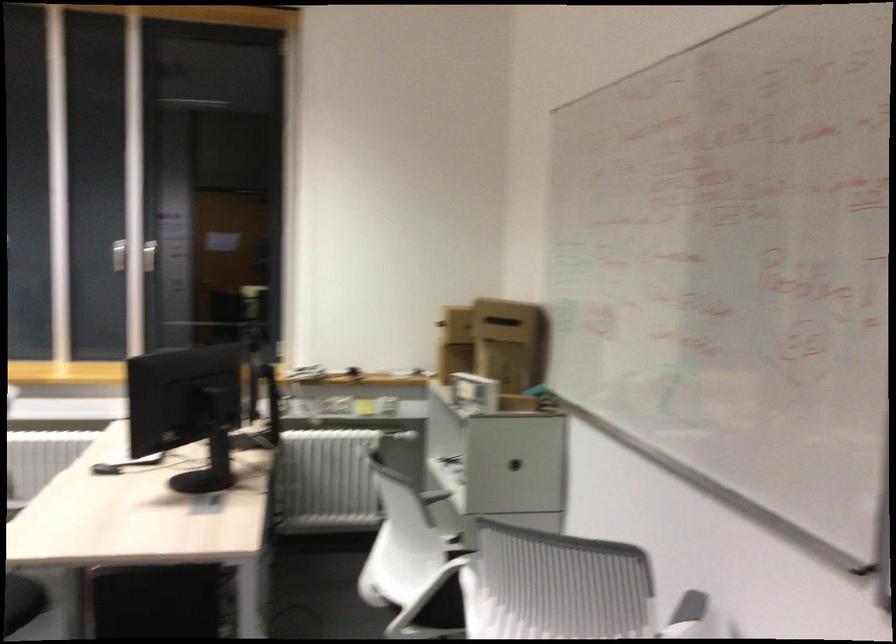
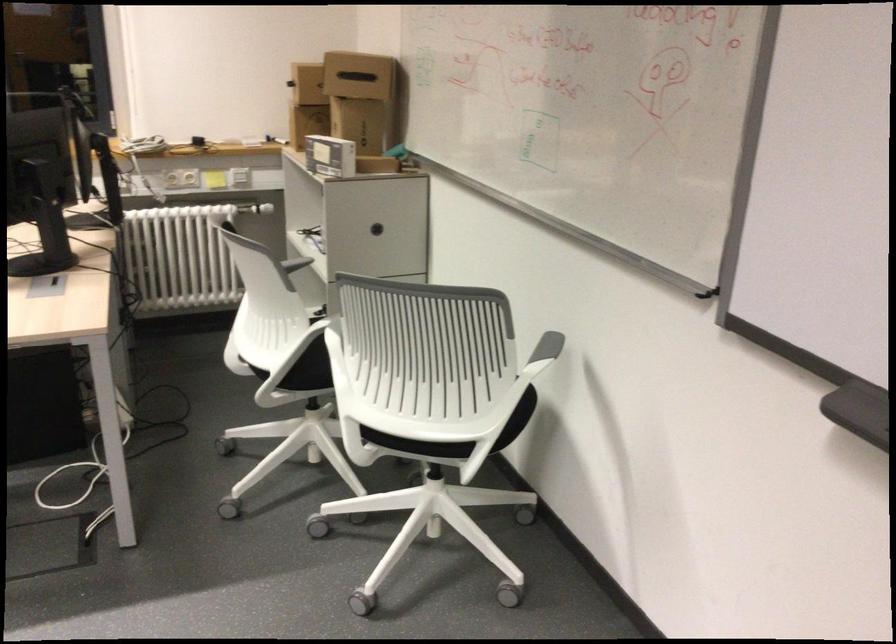
The point at (501, 361) is marked in the first image. Where is the corresponding point in the second image?

(366, 131)